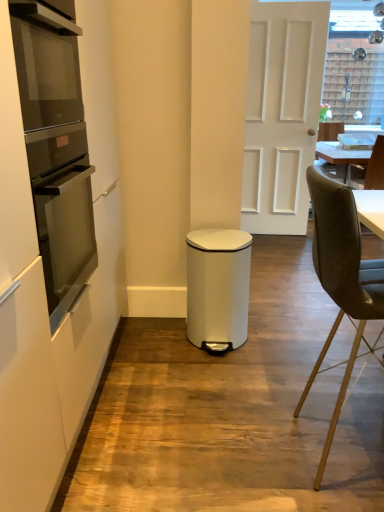
Question: Is point (355, 184) closer or farther from the camera than point (233, 229)?

Choices:
 (A) closer
 (B) farther

Answer: (B)

Question: Is black leather chair at right, the 1th chair positioned from the top, wider or thinner than white matte waste bin at center?

Choices:
 (A) thin
 (B) wide

Answer: (B)

Question: Which is farther from the matte black oven at left?

Choices:
 (A) white matte waste bin at center
 (B) white matte door at center
 (C) white matte cabinet at left
 (D) leather-like brown chair at right, the second chair viewed from the right
 (E) black leather chair at right, which is counted as the second chair, starting from the bottom

Answer: (E)

Question: Estimate the real-world distances between objects in this image. Which object is farther from the matte black oven at left?

Choices:
 (A) leather-like brown chair at right, the second chair viewed from the right
 (B) black leather chair at right, acting as the second chair starting from the front
 (C) white matte door at center
 (D) white matte cabinet at left
 (E) white matte waste bin at center

Answer: (B)